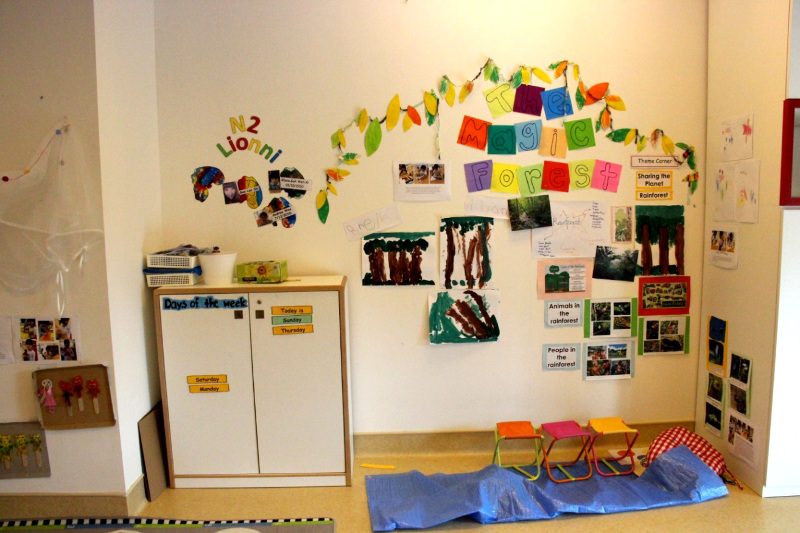
Where is `chair`? chair is located at coordinates (513, 447), (560, 437), (606, 439).